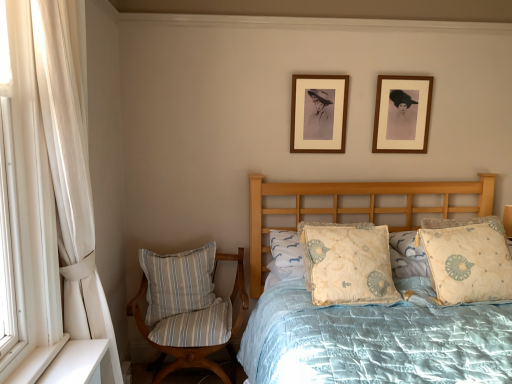
Question: Should I look upward or downward to see matte brown picture frame at upper center, which is the first picture frame from left to right?

Choices:
 (A) down
 (B) up

Answer: (B)

Question: Considering the relative sizes of striped fabric pillow at lower left, which appears as the 4th pillow when viewed from the right, and light beige fabric pillow at center, acting as the 3th pillow starting from the left, in the image provided, is striped fabric pillow at lower left, which appears as the 4th pillow when viewed from the right, wider than light beige fabric pillow at center, acting as the 3th pillow starting from the left,?

Choices:
 (A) no
 (B) yes

Answer: (A)

Question: Can you confirm if striped fabric pillow at lower left, which is the 1th pillow in left-to-right order, is bigger than light beige fabric pillow at center, which is the second pillow in right-to-left order?

Choices:
 (A) yes
 (B) no

Answer: (B)

Question: Considering the relative sizes of striped fabric pillow at lower left, which is the 1th pillow in left-to-right order, and light beige fabric pillow at center, acting as the 3th pillow starting from the left, in the image provided, is striped fabric pillow at lower left, which is the 1th pillow in left-to-right order, thinner than light beige fabric pillow at center, acting as the 3th pillow starting from the left,?

Choices:
 (A) no
 (B) yes

Answer: (B)

Question: From the image's perspective, does striped fabric pillow at lower left, which appears as the 4th pillow when viewed from the right, appear lower than light beige fabric pillow at center, which is the second pillow in right-to-left order?

Choices:
 (A) no
 (B) yes

Answer: (B)

Question: Is striped fabric pillow at lower left, which is the 1th pillow in left-to-right order, shorter than light beige fabric pillow at center, which is the second pillow in right-to-left order?

Choices:
 (A) no
 (B) yes

Answer: (A)

Question: Is striped fabric pillow at lower left, which appears as the 4th pillow when viewed from the right, smaller than light beige fabric pillow at center, acting as the 3th pillow starting from the left?

Choices:
 (A) yes
 (B) no

Answer: (A)

Question: Is striped fabric chair at left positioned far away from wooden picture frame at upper right, the second picture frame positioned from the left?

Choices:
 (A) no
 (B) yes

Answer: (B)

Question: Considering the relative sizes of striped fabric chair at left and wooden picture frame at upper right, the second picture frame positioned from the left, in the image provided, is striped fabric chair at left smaller than wooden picture frame at upper right, the second picture frame positioned from the left,?

Choices:
 (A) yes
 (B) no

Answer: (B)

Question: Would you say striped fabric chair at left is outside wooden picture frame at upper right, the second picture frame positioned from the left?

Choices:
 (A) no
 (B) yes

Answer: (B)

Question: Considering the relative sizes of striped fabric chair at left and wooden picture frame at upper right, positioned as the first picture frame in right-to-left order, in the image provided, is striped fabric chair at left taller than wooden picture frame at upper right, positioned as the first picture frame in right-to-left order,?

Choices:
 (A) no
 (B) yes

Answer: (B)

Question: From a real-world perspective, is striped fabric chair at left below wooden picture frame at upper right, positioned as the first picture frame in right-to-left order?

Choices:
 (A) yes
 (B) no

Answer: (A)

Question: Would you say wooden picture frame at upper right, positioned as the first picture frame in right-to-left order, is part of striped fabric chair at left's contents?

Choices:
 (A) yes
 (B) no

Answer: (B)

Question: Can you confirm if striped fabric pillow at lower left, which is the 1th pillow in left-to-right order, is positioned to the right of light beige fabric pillow at center, the third pillow positioned from the right?

Choices:
 (A) no
 (B) yes

Answer: (A)